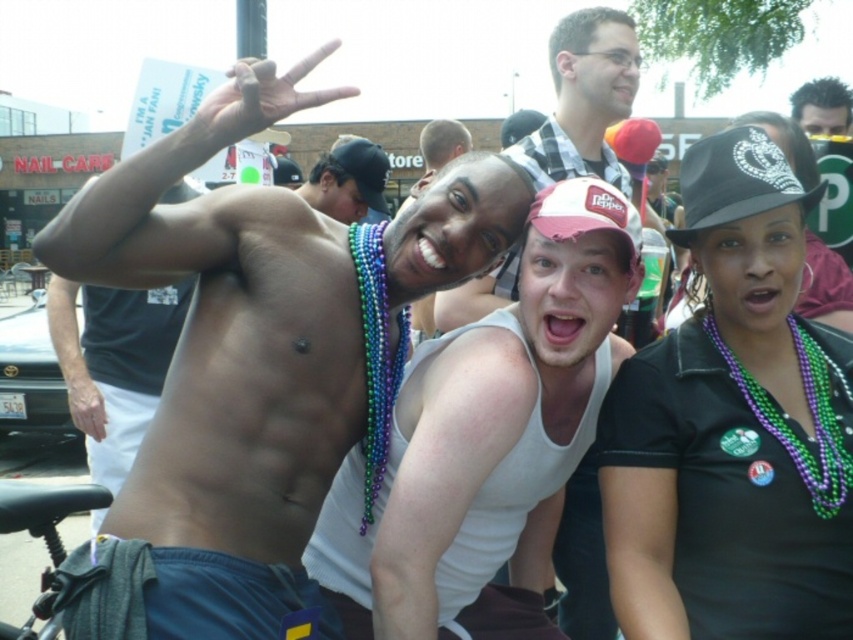
Can you confirm if white fabric baseball cap at center is positioned to the right of dark brown hair at upper right?

No, white fabric baseball cap at center is not to the right of dark brown hair at upper right.

Is white fabric baseball cap at center wider than dark brown hair at upper right?

In fact, white fabric baseball cap at center might be narrower than dark brown hair at upper right.

This screenshot has height=640, width=853. What do you see at coordinates (584, 211) in the screenshot?
I see `white fabric baseball cap at center` at bounding box center [584, 211].

The width and height of the screenshot is (853, 640). I want to click on white fabric baseball cap at center, so tap(584, 211).

Which of these two, white cotton shirt at center or black sequined baseball cap at upper right, stands taller?

white cotton shirt at center

Measure the distance from white cotton shirt at center to black sequined baseball cap at upper right.

white cotton shirt at center is 33.78 inches from black sequined baseball cap at upper right.

Between point (563, 64) and point (689, 147), which one is positioned in front?

Point (689, 147) is in front.

Where is `white cotton shirt at center`? The image size is (853, 640). white cotton shirt at center is located at coordinates (584, 99).

Between white cotton shirt at center and white fabric baseball cap at center, which one is positioned higher?

white cotton shirt at center

Does white cotton shirt at center come in front of white fabric baseball cap at center?

That is False.

At what (x,y) coordinates should I click in order to perform the action: click on white cotton shirt at center. Please return your answer as a coordinate pair (x, y). Looking at the image, I should click on (584, 99).